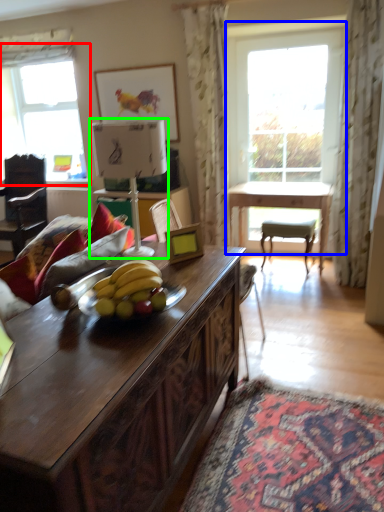
Question: Which object is positioned farthest from window (highlighted by a red box)? Select from window (highlighted by a blue box) and lamp (highlighted by a green box).

Choices:
 (A) window
 (B) lamp

Answer: (B)